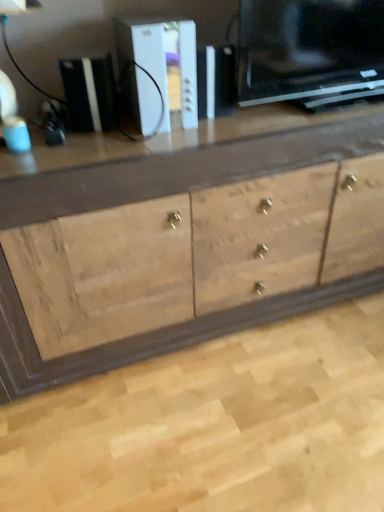
The image size is (384, 512). Identify the location of free space in front of white plastic console at center, arranged as the second appliance when viewed from the left. (145, 148).